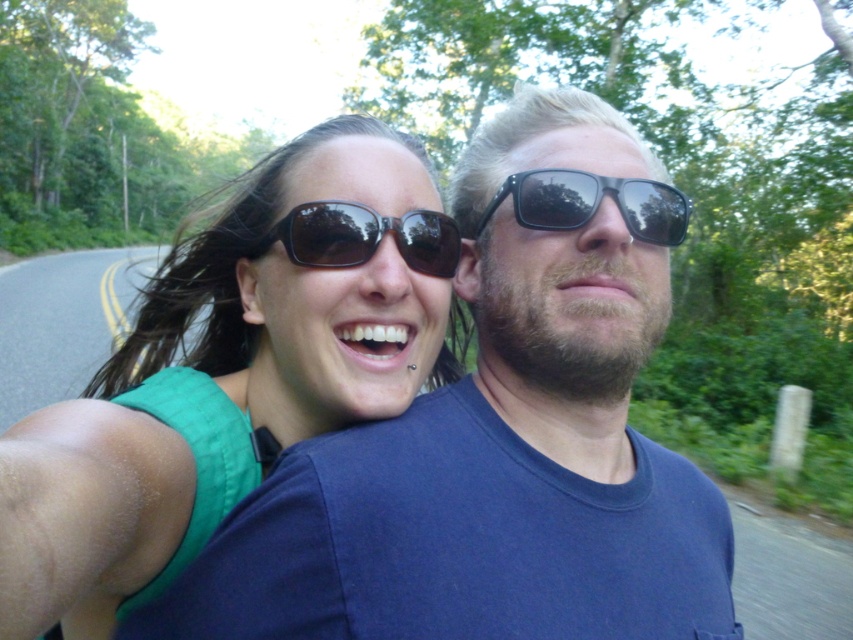
You are a photographer trying to position two subjects in a photo. The subjects are the blue matte shirt at center and the green fabric top at upper left. According to the scene, which subject is positioned to the right of the other?

The blue matte shirt at center is positioned to the right of the green fabric top at upper left.

You are holding a drone that has a maximum flight range of 30 inches. You want to fly it from your current position to point (x=694, y=616). Can the drone reach that point?

The distance between point (x=694, y=616) and the camera is 36.41 inches. Since the drone can only fly up to 30 inches, it cannot reach that point.

You are a photographer trying to capture the two people in the image. If you want to focus on the sunglasses at center and the black reflective sunglasses at upper center, which one would you need to adjust your camera focus for because it appears smaller?

The sunglasses at center has a lesser height compared to the black reflective sunglasses at upper center, so you would need to adjust the camera focus for the sunglasses at center since it appears smaller.